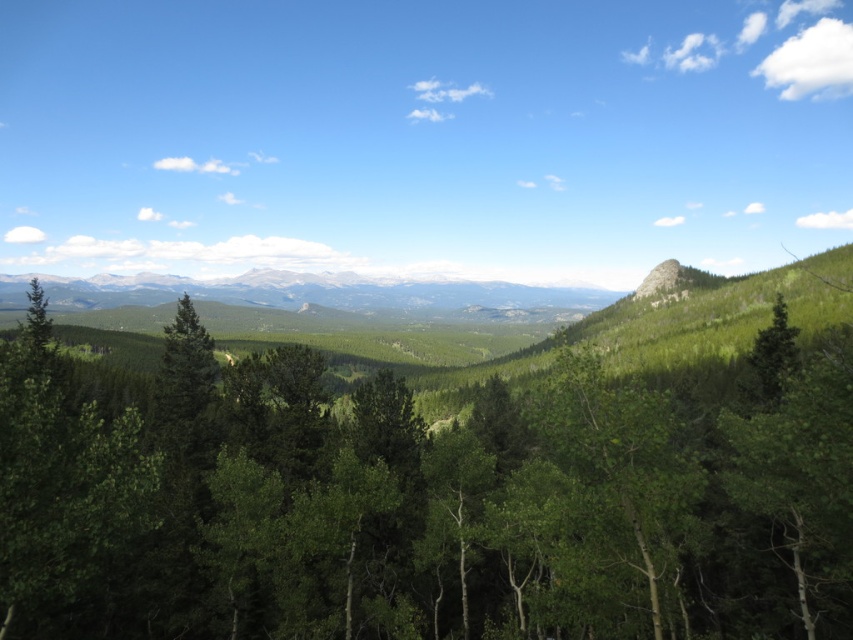
Question: Which object appears closest to the camera in this image?

Choices:
 (A) green leafy tree at center
 (B) rocky gray mountain range at center
 (C) green matte tree at right

Answer: (A)

Question: Can you confirm if green leafy tree at center is smaller than green matte tree at right?

Choices:
 (A) no
 (B) yes

Answer: (A)

Question: Which point is farther to the camera?

Choices:
 (A) (607, 467)
 (B) (93, 289)
 (C) (753, 390)

Answer: (B)

Question: Can you confirm if green leafy tree at center is positioned below rocky gray mountain range at center?

Choices:
 (A) yes
 (B) no

Answer: (A)

Question: Estimate the real-world distances between objects in this image. Which object is closer to the green matte tree at right?

Choices:
 (A) green leafy tree at center
 (B) rocky gray mountain range at center

Answer: (A)

Question: Can you confirm if rocky gray mountain range at center is positioned above green matte tree at right?

Choices:
 (A) no
 (B) yes

Answer: (B)